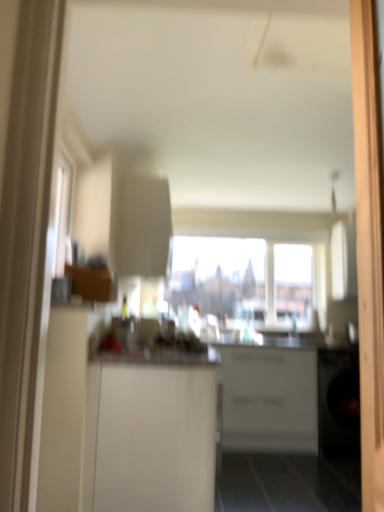
Question: Which direction should I rotate to look at white matte cabinet at center, marked as the 1th cabinetry in a front-to-back arrangement, — up or down?

Choices:
 (A) up
 (B) down

Answer: (B)

Question: Does white glossy counter at center have a lesser width compared to transparent glass window at center?

Choices:
 (A) yes
 (B) no

Answer: (B)

Question: Considering the relative positions of white glossy counter at center and transparent glass window at center in the image provided, is white glossy counter at center behind transparent glass window at center?

Choices:
 (A) yes
 (B) no

Answer: (B)

Question: From a real-world perspective, is white glossy counter at center on top of transparent glass window at center?

Choices:
 (A) no
 (B) yes

Answer: (A)

Question: Is white glossy counter at center facing towards transparent glass window at center?

Choices:
 (A) yes
 (B) no

Answer: (B)

Question: Is the depth of white glossy counter at center less than that of transparent glass window at center?

Choices:
 (A) no
 (B) yes

Answer: (B)

Question: Considering the relative sizes of white glossy counter at center and transparent glass window at center in the image provided, is white glossy counter at center wider than transparent glass window at center?

Choices:
 (A) yes
 (B) no

Answer: (A)

Question: Is white glossy counter at center completely or partially outside of white matte cabinet at center, which is the 1th cabinetry in back-to-front order?

Choices:
 (A) yes
 (B) no

Answer: (A)

Question: Can you confirm if white glossy counter at center is positioned to the right of white matte cabinet at center, which is the 1th cabinetry in back-to-front order?

Choices:
 (A) no
 (B) yes

Answer: (A)

Question: From the image's perspective, is white glossy counter at center on top of white matte cabinet at center, which is the 1th cabinetry in back-to-front order?

Choices:
 (A) yes
 (B) no

Answer: (A)

Question: Does white glossy counter at center come behind white matte cabinet at center, the 2th cabinetry viewed from the front?

Choices:
 (A) yes
 (B) no

Answer: (B)

Question: Can you confirm if white glossy counter at center is shorter than white matte cabinet at center, the 2th cabinetry viewed from the front?

Choices:
 (A) no
 (B) yes

Answer: (A)

Question: Considering the relative sizes of white glossy counter at center and white matte cabinet at center, the 2th cabinetry viewed from the front, in the image provided, is white glossy counter at center thinner than white matte cabinet at center, the 2th cabinetry viewed from the front,?

Choices:
 (A) yes
 (B) no

Answer: (B)

Question: Is the surface of transparent glass window at center in direct contact with white matte cabinet at center, which is the 1th cabinetry in back-to-front order?

Choices:
 (A) yes
 (B) no

Answer: (B)